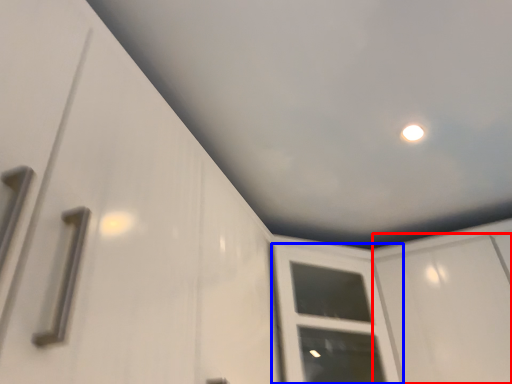
Question: Which of the following is the farthest to the observer, screen door (highlighted by a red box) or window frame (highlighted by a blue box)?

Choices:
 (A) screen door
 (B) window frame

Answer: (B)